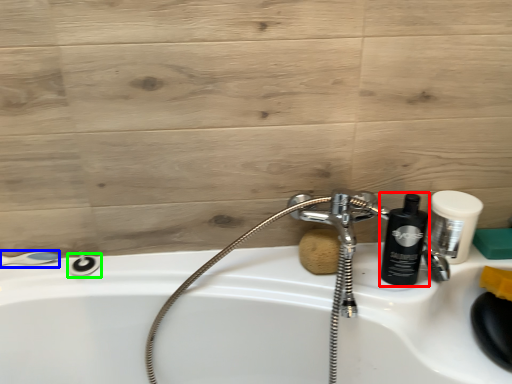
Question: Which is farther away from shaving cream (highlighted by a red box)? shower (highlighted by a blue box) or shower (highlighted by a green box)?

Choices:
 (A) shower
 (B) shower

Answer: (A)